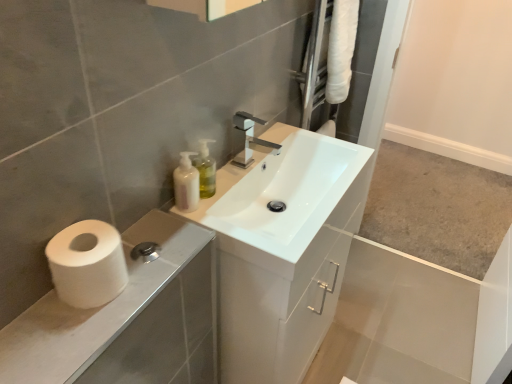
Question: Considering the relative positions of white matte pump bottle at upper center and translucent plastic soap dispenser at upper center in the image provided, is white matte pump bottle at upper center to the left of translucent plastic soap dispenser at upper center from the viewer's perspective?

Choices:
 (A) no
 (B) yes

Answer: (B)

Question: Does white matte pump bottle at upper center have a lesser height compared to translucent plastic soap dispenser at upper center?

Choices:
 (A) yes
 (B) no

Answer: (A)

Question: Is white matte pump bottle at upper center positioned with its back to translucent plastic soap dispenser at upper center?

Choices:
 (A) yes
 (B) no

Answer: (B)

Question: From a real-world perspective, is white matte pump bottle at upper center positioned under translucent plastic soap dispenser at upper center based on gravity?

Choices:
 (A) yes
 (B) no

Answer: (A)

Question: Are white matte pump bottle at upper center and translucent plastic soap dispenser at upper center far apart?

Choices:
 (A) yes
 (B) no

Answer: (B)

Question: Considering the relative sizes of white matte pump bottle at upper center and translucent plastic soap dispenser at upper center in the image provided, is white matte pump bottle at upper center taller than translucent plastic soap dispenser at upper center?

Choices:
 (A) yes
 (B) no

Answer: (B)

Question: From the image's perspective, is translucent plastic soap dispenser at upper center over white glossy sink at center?

Choices:
 (A) no
 (B) yes

Answer: (B)

Question: Considering the relative positions of translucent plastic soap dispenser at upper center and white glossy sink at center in the image provided, is translucent plastic soap dispenser at upper center in front of white glossy sink at center?

Choices:
 (A) no
 (B) yes

Answer: (A)

Question: Does translucent plastic soap dispenser at upper center have a greater width compared to white glossy sink at center?

Choices:
 (A) yes
 (B) no

Answer: (B)

Question: Is translucent plastic soap dispenser at upper center further to the viewer compared to white glossy sink at center?

Choices:
 (A) no
 (B) yes

Answer: (B)

Question: Is translucent plastic soap dispenser at upper center shorter than white glossy sink at center?

Choices:
 (A) no
 (B) yes

Answer: (B)

Question: From a real-world perspective, is translucent plastic soap dispenser at upper center physically below white glossy sink at center?

Choices:
 (A) yes
 (B) no

Answer: (B)

Question: Considering the relative sizes of white glossy cabinet at lower left and white matte pump bottle at upper center in the image provided, is white glossy cabinet at lower left taller than white matte pump bottle at upper center?

Choices:
 (A) yes
 (B) no

Answer: (B)